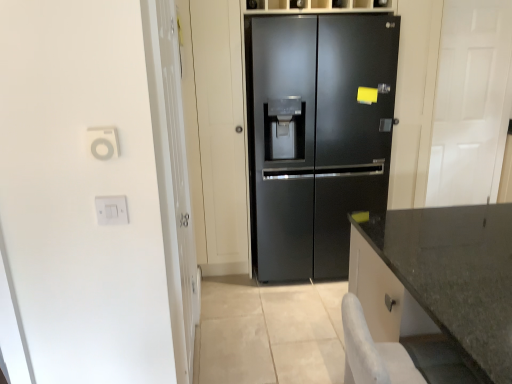
Question: Is transparent glass door at left, which appears as the 2th glass door when viewed from the right, shorter than white plastic outlet at upper left, which is counted as the second electric outlet, starting from the bottom?

Choices:
 (A) yes
 (B) no

Answer: (B)

Question: Is transparent glass door at left, positioned as the 1th glass door in left-to-right order, wider than white plastic outlet at upper left, which is counted as the 2th electric outlet, starting from the back?

Choices:
 (A) no
 (B) yes

Answer: (B)

Question: Can you see transparent glass door at left, which appears as the 2th glass door when viewed from the right, touching white plastic outlet at upper left, the 1th electric outlet from the top?

Choices:
 (A) no
 (B) yes

Answer: (A)

Question: Can you confirm if transparent glass door at left, positioned as the 1th glass door in left-to-right order, is smaller than white plastic outlet at upper left, which is counted as the 2th electric outlet, starting from the back?

Choices:
 (A) yes
 (B) no

Answer: (B)

Question: Does transparent glass door at left, positioned as the second glass door in back-to-front order, have a larger size compared to white plastic outlet at upper left, marked as the 1th electric outlet in a front-to-back arrangement?

Choices:
 (A) no
 (B) yes

Answer: (B)

Question: Is transparent glass door at left, which is the first glass door from front to back, in front of white plastic outlet at upper left, marked as the 1th electric outlet in a front-to-back arrangement?

Choices:
 (A) yes
 (B) no

Answer: (B)

Question: Is black matte refrigerator at center wider than granite gray countertop at lower right?

Choices:
 (A) no
 (B) yes

Answer: (B)

Question: Can you confirm if black matte refrigerator at center is shorter than granite gray countertop at lower right?

Choices:
 (A) yes
 (B) no

Answer: (B)

Question: Is black matte refrigerator at center outside granite gray countertop at lower right?

Choices:
 (A) no
 (B) yes

Answer: (B)

Question: Considering the relative sizes of black matte refrigerator at center and granite gray countertop at lower right in the image provided, is black matte refrigerator at center taller than granite gray countertop at lower right?

Choices:
 (A) no
 (B) yes

Answer: (B)

Question: From a real-world perspective, is black matte refrigerator at center below granite gray countertop at lower right?

Choices:
 (A) yes
 (B) no

Answer: (B)

Question: From the image's perspective, is black matte refrigerator at center under granite gray countertop at lower right?

Choices:
 (A) yes
 (B) no

Answer: (B)

Question: Is granite gray countertop at lower right at the right side of white glossy door at right, marked as the second glass door in a left-to-right arrangement?

Choices:
 (A) yes
 (B) no

Answer: (B)